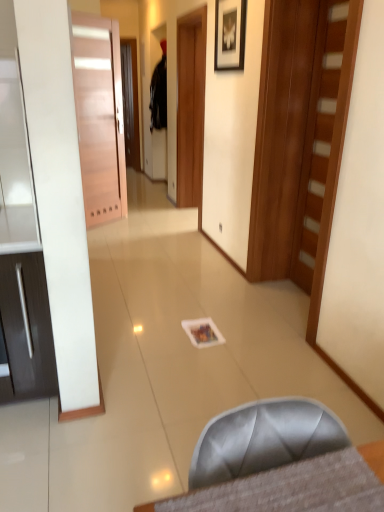
Question: Does matte black picture frame at upper center have a larger size compared to satin gray chair at lower center?

Choices:
 (A) no
 (B) yes

Answer: (A)

Question: Considering the relative sizes of matte black picture frame at upper center and satin gray chair at lower center in the image provided, is matte black picture frame at upper center smaller than satin gray chair at lower center?

Choices:
 (A) no
 (B) yes

Answer: (B)

Question: Is matte black picture frame at upper center taller than satin gray chair at lower center?

Choices:
 (A) no
 (B) yes

Answer: (B)

Question: Is matte black picture frame at upper center oriented towards satin gray chair at lower center?

Choices:
 (A) no
 (B) yes

Answer: (A)

Question: Does matte black picture frame at upper center have a lesser height compared to satin gray chair at lower center?

Choices:
 (A) yes
 (B) no

Answer: (B)

Question: Is matte black picture frame at upper center further to the viewer compared to satin gray chair at lower center?

Choices:
 (A) yes
 (B) no

Answer: (A)

Question: Does matte pink door at left, placed as the 2th door when sorted from right to left, come behind satin gray chair at lower center?

Choices:
 (A) yes
 (B) no

Answer: (A)

Question: Could you tell me if matte pink door at left, which is the first door in back-to-front order, is facing satin gray chair at lower center?

Choices:
 (A) yes
 (B) no

Answer: (B)

Question: Considering the relative sizes of matte pink door at left, placed as the 2th door when sorted from right to left, and satin gray chair at lower center in the image provided, is matte pink door at left, placed as the 2th door when sorted from right to left, thinner than satin gray chair at lower center?

Choices:
 (A) yes
 (B) no

Answer: (A)

Question: Can you confirm if matte pink door at left, which appears as the second door when viewed from the front, is bigger than satin gray chair at lower center?

Choices:
 (A) yes
 (B) no

Answer: (A)

Question: Considering the relative sizes of matte pink door at left, which appears as the second door when viewed from the front, and satin gray chair at lower center in the image provided, is matte pink door at left, which appears as the second door when viewed from the front, smaller than satin gray chair at lower center?

Choices:
 (A) no
 (B) yes

Answer: (A)

Question: Would you say satin gray chair at lower center is part of matte pink door at left, placed as the 2th door when sorted from right to left,'s contents?

Choices:
 (A) yes
 (B) no

Answer: (B)

Question: Does matte black picture frame at upper center lie in front of black fabric robe at upper center?

Choices:
 (A) yes
 (B) no

Answer: (A)